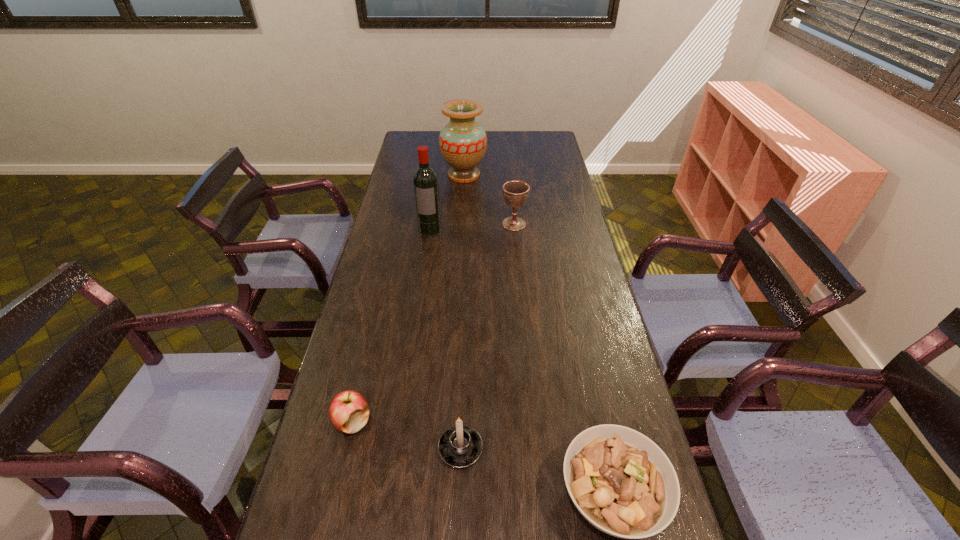
You are a GUI agent. You are given a task and a screenshot of the screen. Output one action in this format:
    pyautogui.click(x=<x>, y=<y>)
    Task: Click on the free space between the fourth shortest object and the farthest object
    The image size is (960, 540).
    Given the screenshot: What is the action you would take?
    pyautogui.click(x=489, y=200)

Locate an element on the screen. object that is the fourth closest one to the leftmost object is located at coordinates (515, 192).

Locate which object ranks in proximity to the chalice. Please provide its 2D coordinates. Your answer should be formatted as a tuple, i.e. [(x, y)], where the tuple contains the x and y coordinates of a point satisfying the conditions above.

[(463, 142)]

At what (x,y) coordinates should I click in order to perform the action: click on vacant space that satisfies the following two spatial constraints: 1. with a handle on the side of the candle holder; 2. on the left side of the third tallest object. Please return your answer as a coordinate pair (x, y). Looking at the image, I should click on (468, 224).